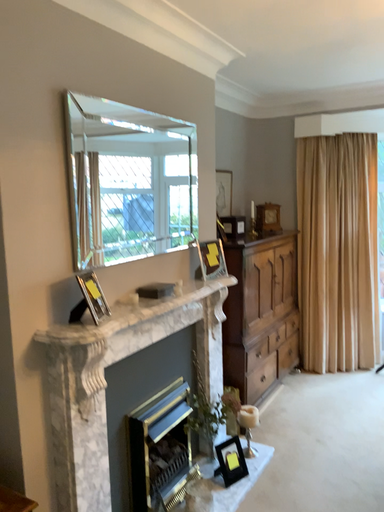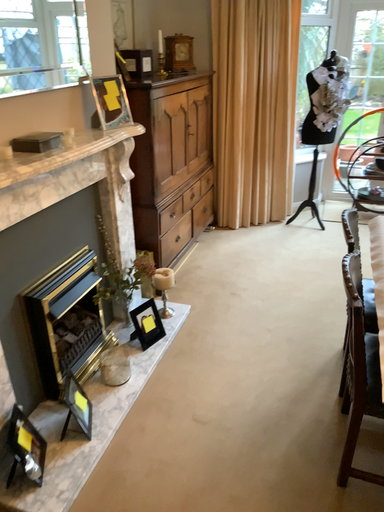
Question: How did the camera likely rotate when shooting the video?

Choices:
 (A) rotated left
 (B) rotated right

Answer: (B)